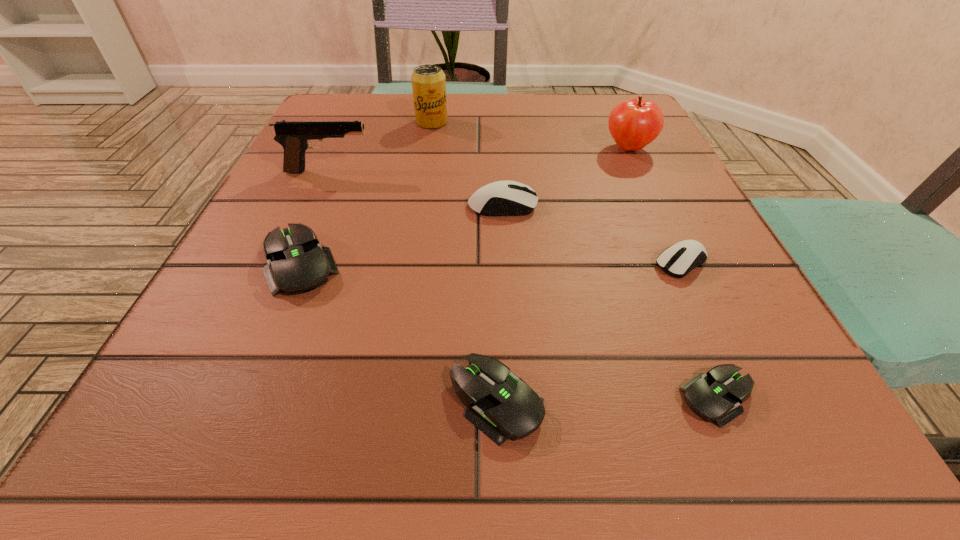
Locate an element on the screen. The height and width of the screenshot is (540, 960). free location that satisfies the following two spatial constraints: 1. on the back side of the sixth object from right to left; 2. on the right side of the farthest gray computer mouse is located at coordinates (361, 122).

At what (x,y) coordinates should I click in order to perform the action: click on free space that satisfies the following two spatial constraints: 1. at the muzzle of the black pistol; 2. on the left side of the farther white mouse. Please return your answer as a coordinate pair (x, y). Looking at the image, I should click on (313, 206).

You are a GUI agent. You are given a task and a screenshot of the screen. Output one action in this format:
    pyautogui.click(x=<x>, y=<y>)
    Task: Click on the free space that satisfies the following two spatial constraints: 1. on the front side of the sixth object from right to left; 2. at the muzzle of the black pistol
    This screenshot has width=960, height=540.
    Given the screenshot: What is the action you would take?
    pyautogui.click(x=423, y=171)

You are a GUI agent. You are given a task and a screenshot of the screen. Output one action in this format:
    pyautogui.click(x=<x>, y=<y>)
    Task: Click on the free point that satisfies the following two spatial constraints: 1. at the muzzle of the third farthest object; 2. on the back side of the biggest gray computer mouse
    Image resolution: width=960 pixels, height=540 pixels.
    Given the screenshot: What is the action you would take?
    pyautogui.click(x=287, y=264)